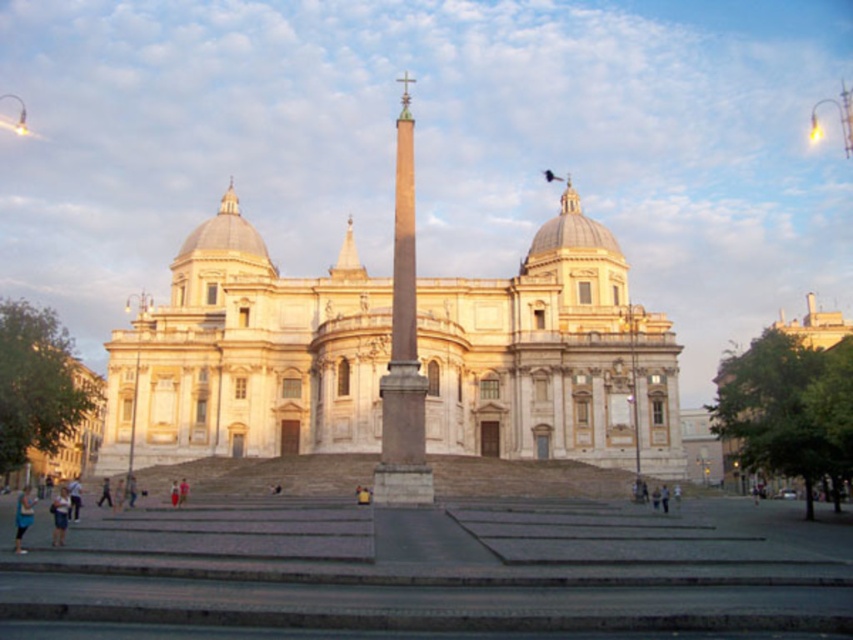
Which is below, blue denim jeans at lower left or skinny jeans at lower left?

blue denim jeans at lower left is lower down.

Does blue denim jeans at lower left have a lesser width compared to skinny jeans at lower left?

In fact, blue denim jeans at lower left might be wider than skinny jeans at lower left.

Identify the location of blue denim jeans at lower left. The image size is (853, 640). (22, 516).

Which is in front, point (457, 294) or point (53, 516)?

Point (53, 516) is more forward.

I want to click on white marble church at center, so click(x=248, y=356).

From the picture: Does white marble church at center have a greater height compared to smooth stone obelisk at center?

In fact, white marble church at center may be shorter than smooth stone obelisk at center.

Does point (660, 355) come closer to viewer compared to point (399, 145)?

That is False.

Where is `white marble church at center`? white marble church at center is located at coordinates (248, 356).